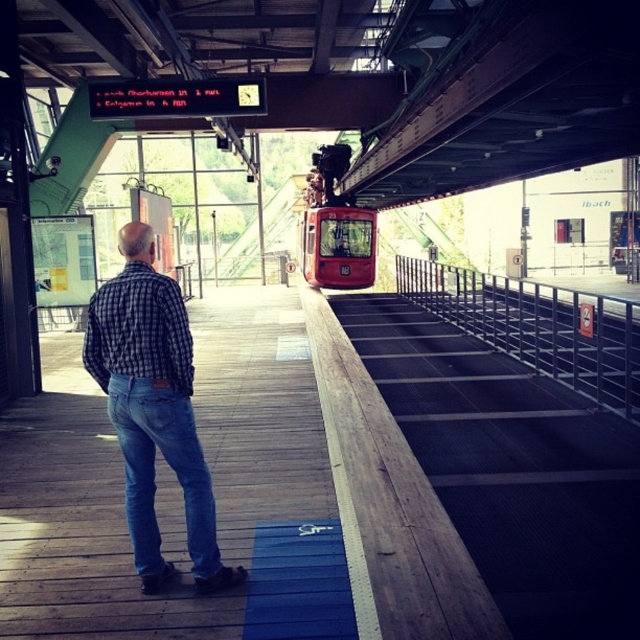
Does smooth metal train track at center appear on the right side of blue denim jeans at lower left?

Yes, smooth metal train track at center is to the right of blue denim jeans at lower left.

Which is above, smooth metal train track at center or blue denim jeans at lower left?

smooth metal train track at center is higher up.

Is point (541, 536) positioned in front of point (216, 538)?

No, (541, 536) is further to viewer.

Image resolution: width=640 pixels, height=640 pixels. Find the location of `smooth metal train track at center`. smooth metal train track at center is located at coordinates (513, 468).

Looking at this image, who is more forward, (627, 403) or (156, 541)?

Point (156, 541) is in front.

Can you confirm if black metal rail at right is positioned below blue denim jeans at lower left?

No.

Is point (573, 387) in front of point (180, 468)?

No, it is behind (180, 468).

Identify the location of black metal rail at right. (538, 326).

How much distance is there between smooth metal train track at center and checkered fabric shirt at center?

smooth metal train track at center is 9.75 feet from checkered fabric shirt at center.

Which is behind, point (616, 435) or point (147, 540)?

Positioned behind is point (616, 435).

Is point (477, 472) positioned in front of point (152, 467)?

No, (477, 472) is behind (152, 467).

The image size is (640, 640). I want to click on smooth metal train track at center, so click(513, 468).